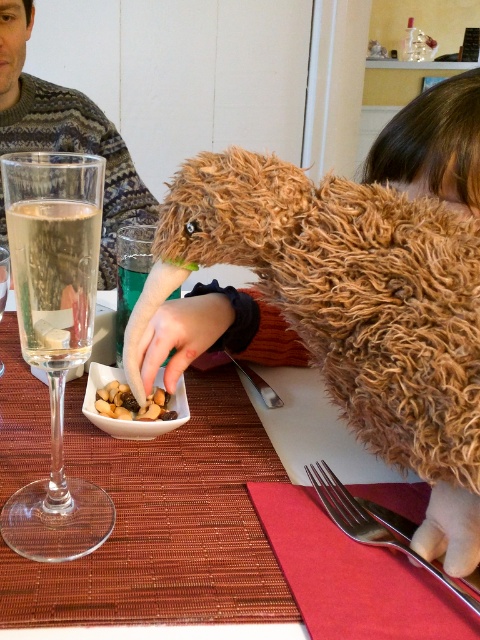
Question: Which of the following is the farthest from the observer?

Choices:
 (A) (163, 422)
 (B) (453, 340)
 (C) (260, 378)
 (D) (0, 310)

Answer: (D)

Question: Can you confirm if shiny metallic bowl of nuts at center is positioned below silver metallic fork at upper center?

Choices:
 (A) yes
 (B) no

Answer: (A)

Question: Which point is farther to the camera?

Choices:
 (A) (263, 390)
 (B) (349, 237)
 (C) (358, 513)
 (D) (119, 385)

Answer: (A)

Question: Can you confirm if fuzzy brown stuffed animal at center is wider than silver metallic fork at upper center?

Choices:
 (A) no
 (B) yes

Answer: (B)

Question: Which object is farther from the camera taking this photo?

Choices:
 (A) silver metallic fork at upper center
 (B) fuzzy brown stuffed animal at center

Answer: (A)

Question: Can you confirm if clear glass wine glass at left is positioned to the left of slightly browned nuts at center?

Choices:
 (A) yes
 (B) no

Answer: (A)